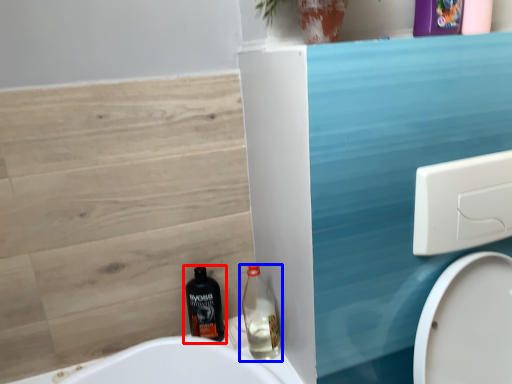
Question: Which point is further to the camera, bottle (highlighted by a red box) or bottle (highlighted by a blue box)?

Choices:
 (A) bottle
 (B) bottle

Answer: (A)